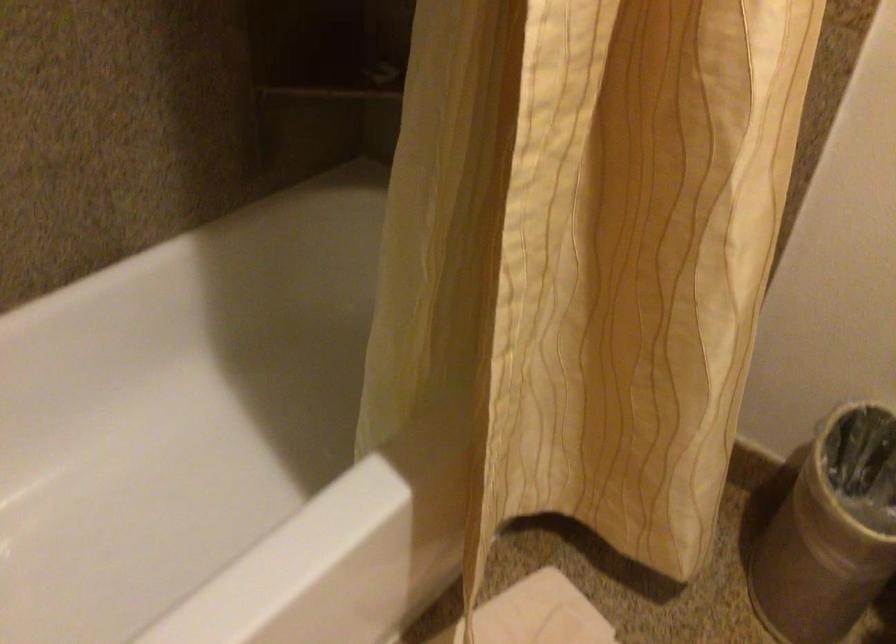
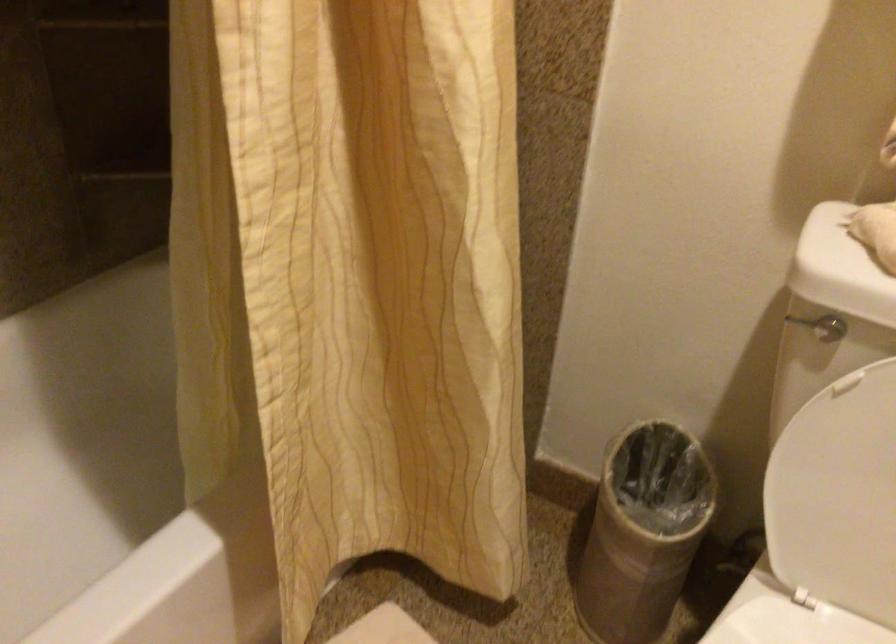
In the scene shown: What movement of the cameraman would produce the second image?

The movement direction of the cameraman is right, backward.